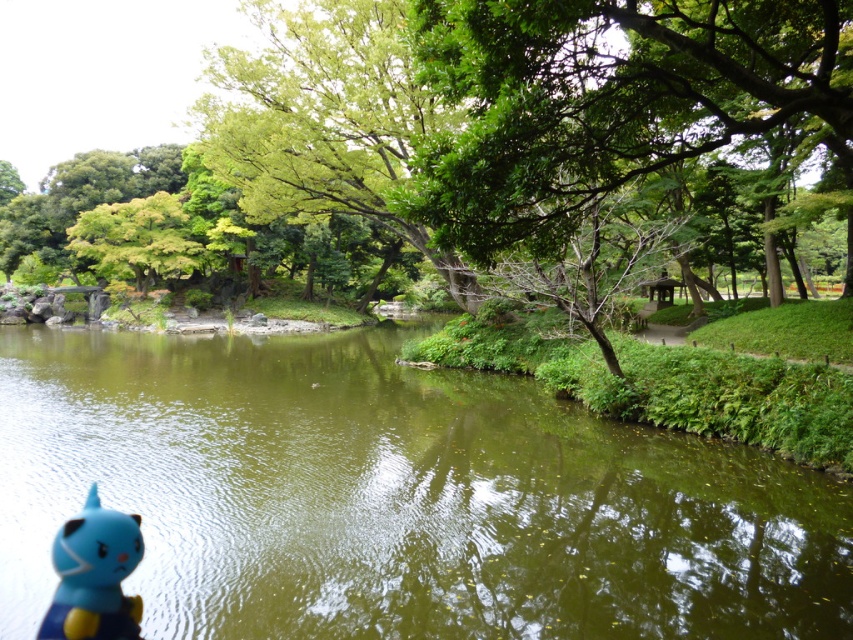
Question: Which point is farther from the camera taking this photo?

Choices:
 (A) tap(76, 547)
 (B) tap(633, 492)
 (C) tap(142, 289)

Answer: (C)

Question: Where is green glossy water at center located in relation to blue matte toy at lower left in the image?

Choices:
 (A) right
 (B) left

Answer: (B)

Question: Can you confirm if green glossy water at center is positioned to the right of green leafy tree at upper left?

Choices:
 (A) yes
 (B) no

Answer: (A)

Question: Is green glossy water at center to the left of green leafy tree at upper left from the viewer's perspective?

Choices:
 (A) yes
 (B) no

Answer: (B)

Question: Which of the following is the farthest from the observer?

Choices:
 (A) (718, 508)
 (B) (86, 627)

Answer: (A)

Question: Which of the following is the farthest from the observer?

Choices:
 (A) (165, 234)
 (B) (96, 582)

Answer: (A)